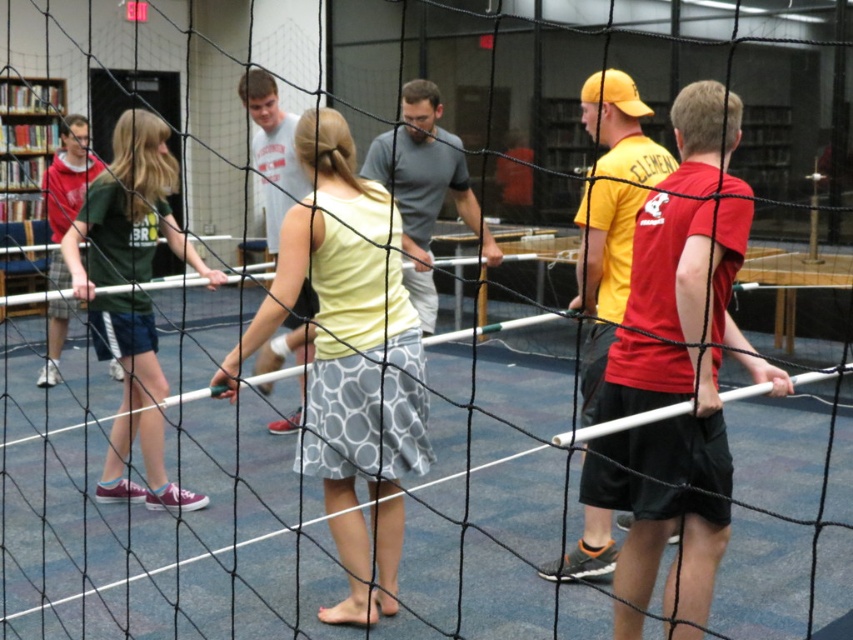
Question: Which point appears farthest from the camera in this image?

Choices:
 (A) (126, 449)
 (B) (387, 436)

Answer: (A)

Question: From the image, what is the correct spatial relationship of light yellow fabric shirt at center in relation to dark green jersey at left?

Choices:
 (A) above
 (B) below

Answer: (B)

Question: Does light yellow fabric shirt at center have a lesser width compared to dark green jersey at left?

Choices:
 (A) no
 (B) yes

Answer: (B)

Question: Which point is closer to the camera?

Choices:
 (A) (149, 225)
 (B) (372, 464)

Answer: (B)

Question: Does light yellow fabric shirt at center appear under dark green jersey at left?

Choices:
 (A) no
 (B) yes

Answer: (B)